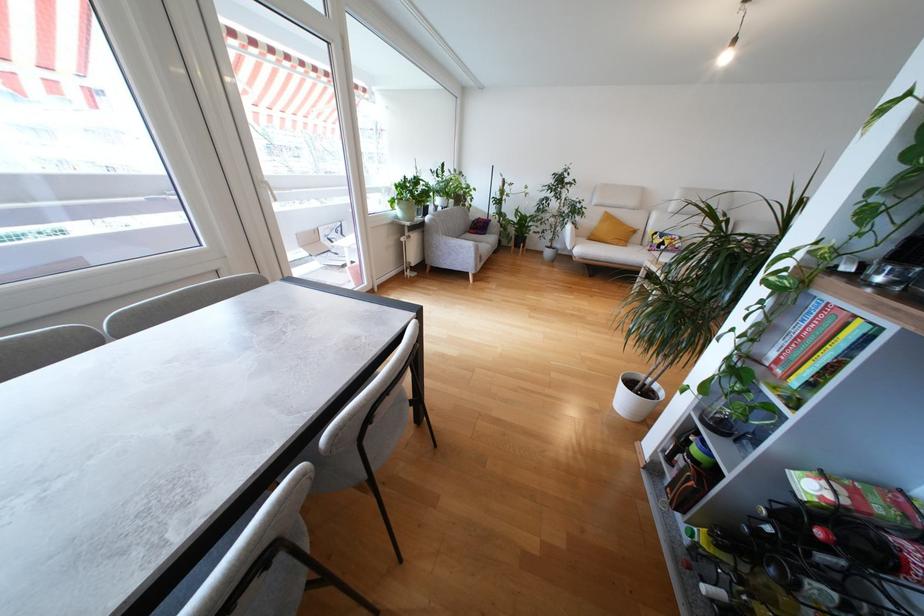
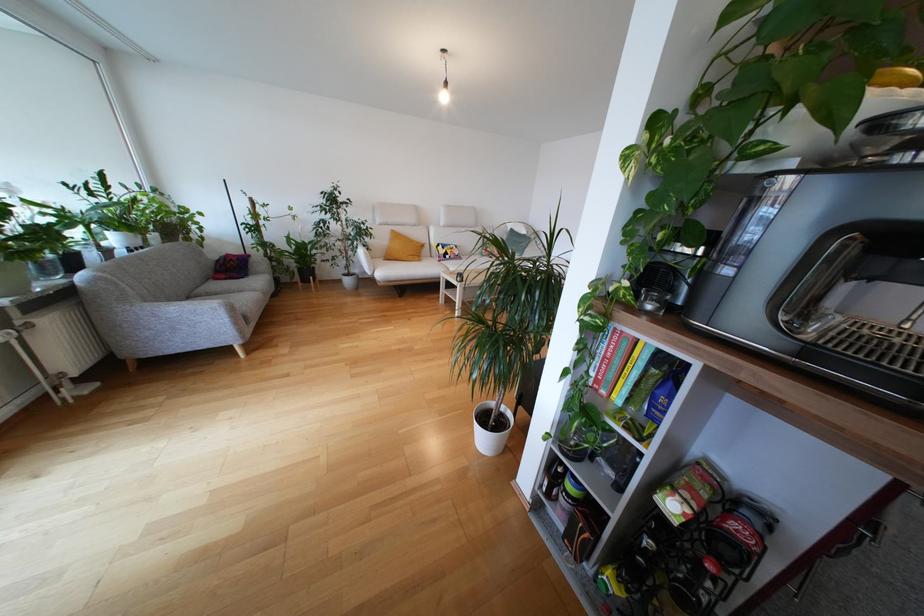
Question: The first image is from the beginning of the video and the second image is from the end. How did the camera likely rotate when shooting the video?

Choices:
 (A) Left
 (B) Right
 (C) Up
 (D) Down

Answer: (B)